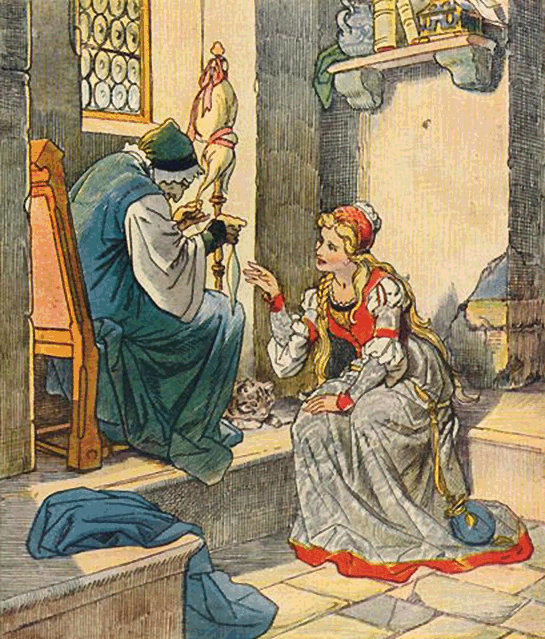
Where is `vase`? vase is located at coordinates (356, 27).